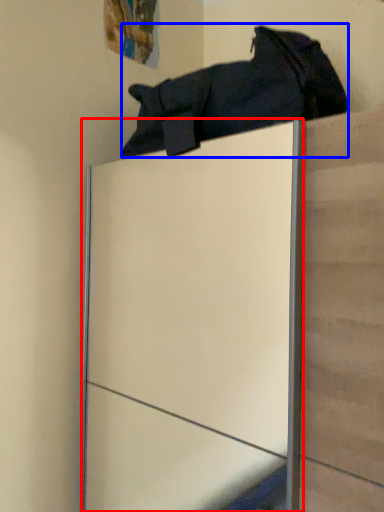
Question: Which of the following is the farthest to the observer, glass door (highlighted by a red box) or footwear (highlighted by a blue box)?

Choices:
 (A) glass door
 (B) footwear

Answer: (B)